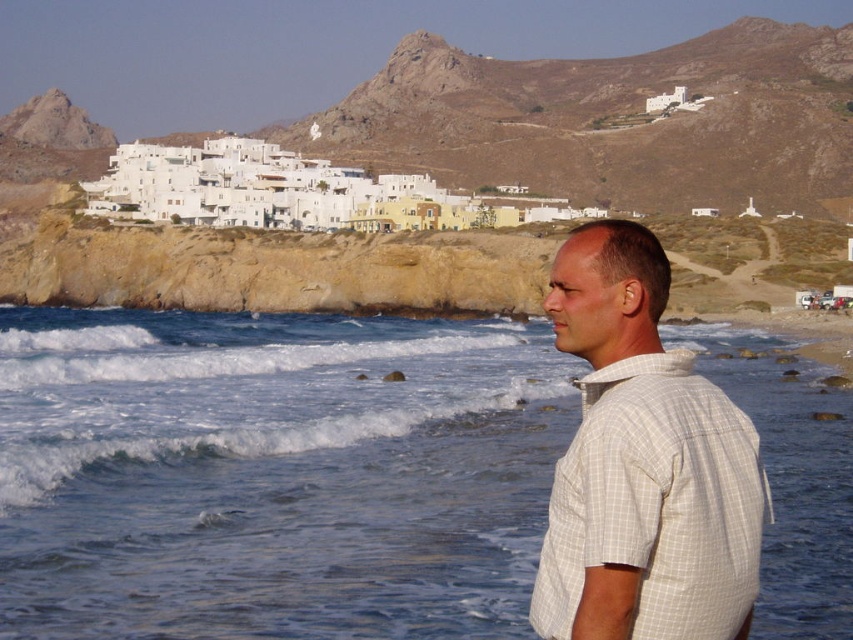
Question: Is blue water at lower left bigger than white checkered shirt at right?

Choices:
 (A) yes
 (B) no

Answer: (A)

Question: Which of the following is the closest to the observer?

Choices:
 (A) white checkered shirt at right
 (B) blue water at lower left

Answer: (A)

Question: Where is blue water at lower left located in relation to white checkered shirt at right in the image?

Choices:
 (A) right
 (B) left

Answer: (B)

Question: Does blue water at lower left appear on the left side of white checkered shirt at right?

Choices:
 (A) yes
 (B) no

Answer: (A)